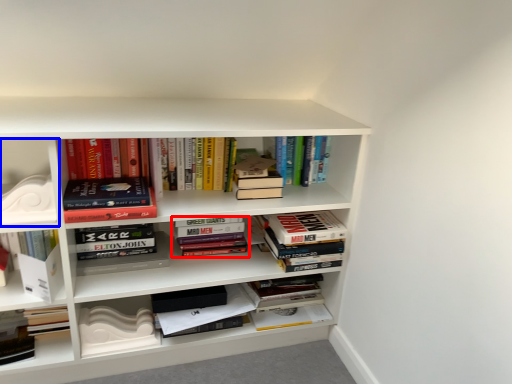
Question: Which point is closer to the camera, book (highlighted by a red box) or shelf (highlighted by a blue box)?

Choices:
 (A) book
 (B) shelf

Answer: (B)